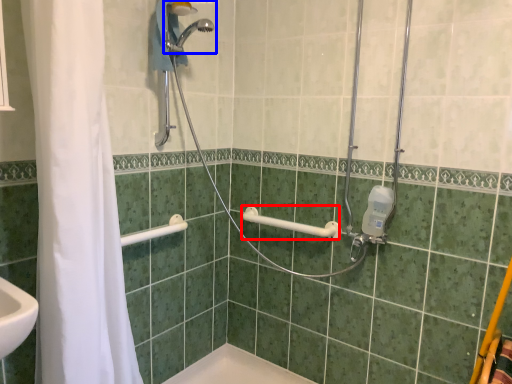
Question: Which object appears farthest to the camera in this image, towel bar (highlighted by a red box) or shower (highlighted by a blue box)?

Choices:
 (A) towel bar
 (B) shower

Answer: (A)